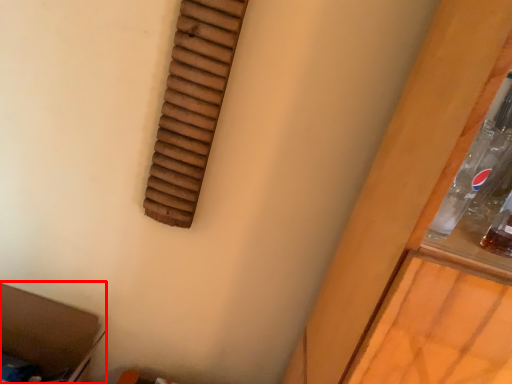
Question: From the image, what is the correct spatial relationship of storage box (annotated by the red box) in relation to window?

Choices:
 (A) right
 (B) left

Answer: (B)